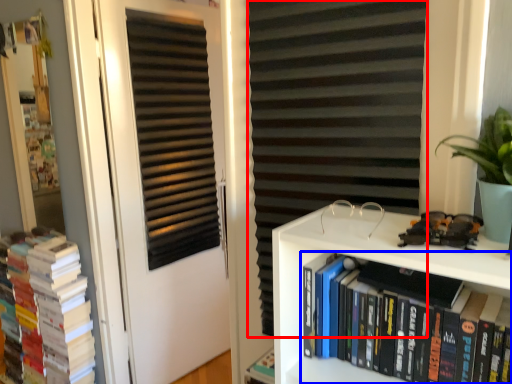
Question: Among these objects, which one is nearest to the camera, curtain (highlighted by a red box) or book (highlighted by a blue box)?

Choices:
 (A) curtain
 (B) book

Answer: (B)